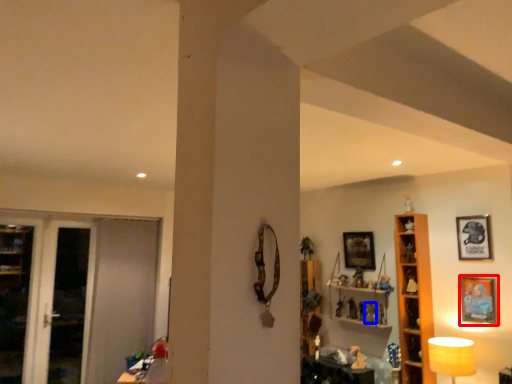
Question: Which point is further to the camera, picture frame (highlighted by a red box) or toy (highlighted by a blue box)?

Choices:
 (A) picture frame
 (B) toy

Answer: (B)